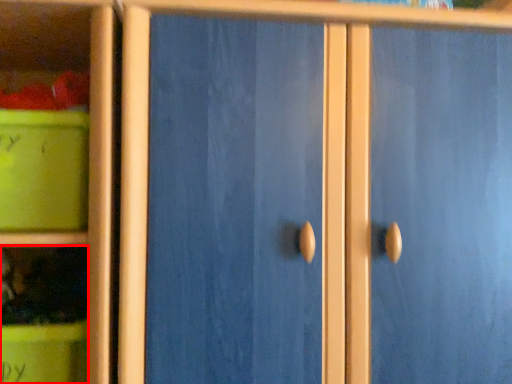
Question: Considering the relative positions of cabinet (annotated by the red box) and storage box in the image provided, where is cabinet (annotated by the red box) located with respect to the staircase?

Choices:
 (A) left
 (B) right

Answer: (B)